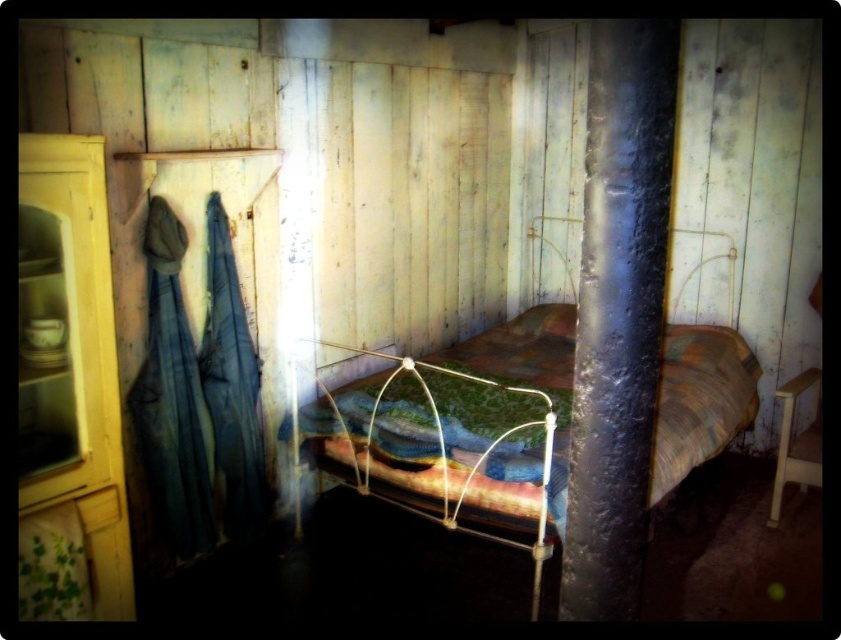
You are standing in the cabin and need to move an object from the black rubberized pole at center to the yellow wood cabinet at left. Which object is closer to you when you start?

The black rubberized pole at center is closer to the viewer than the yellow wood cabinet at left, so the object on the black rubberized pole at center is closer to you when you start.

Consider the image. You are standing in the cabin and want to locate the point at coordinates (617, 312). According to the scene description, where exactly is this point located?

The point at coordinates (617, 312) is located on the black rubberized pole at center.